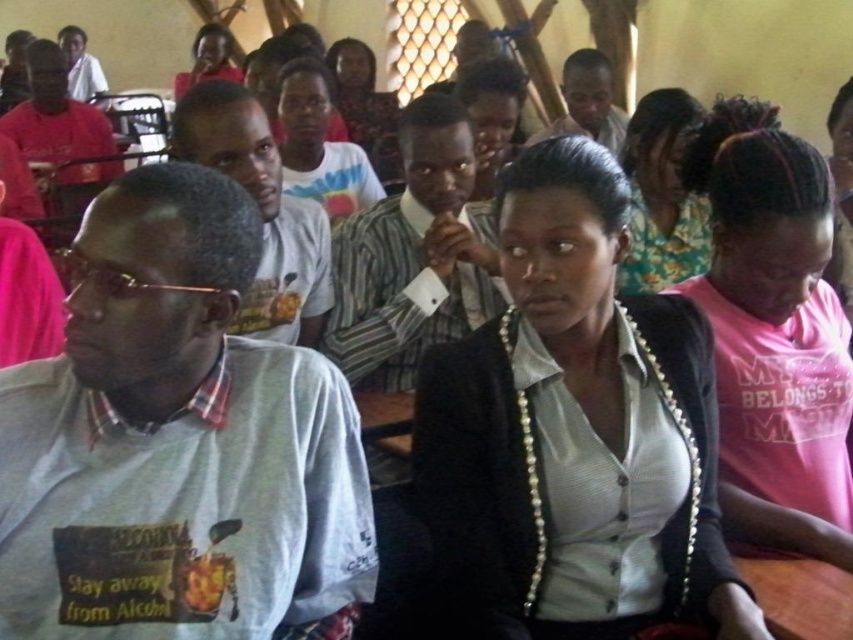
You are standing at the camera position and want to hand a document to the person wearing the matte gray shirt at upper center. Considering the distance, can you comfortably hand it without moving closer?

The matte gray shirt at upper center is 3.51 meters away from the camera, so handing a document at that distance would be difficult without moving closer.